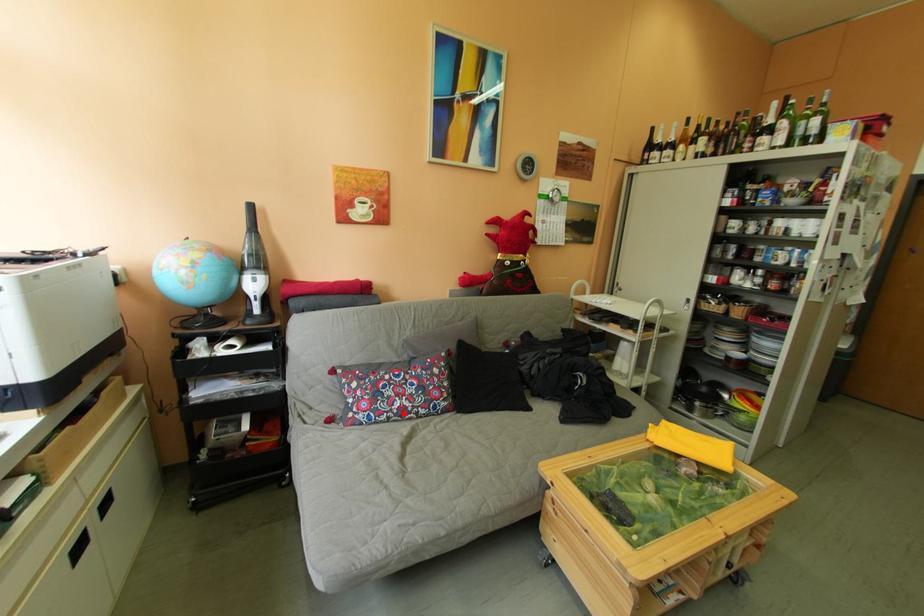
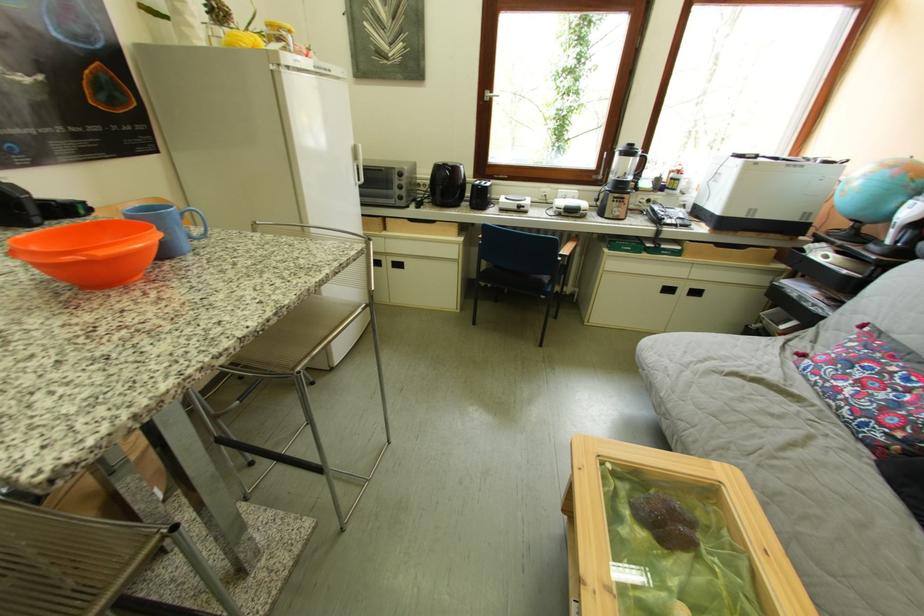
Find the pixel in the second image that matches the highlighted location in the first image.

(841, 384)